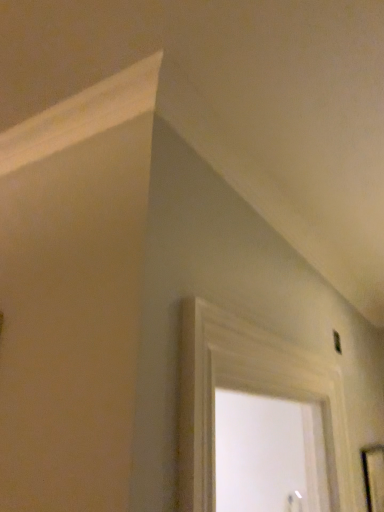
Consider the image. What is the approximate height of black glossy mirror at lower right?

black glossy mirror at lower right is 27.83 centimeters in height.

In order to face black glossy mirror at lower right, should I rotate leftwards or rightwards?

Turn right by 23.591 degrees to look at black glossy mirror at lower right.

The width and height of the screenshot is (384, 512). Describe the element at coordinates (373, 476) in the screenshot. I see `black glossy mirror at lower right` at that location.

At what (x,y) coordinates should I click in order to perform the action: click on black glossy mirror at lower right. Please return your answer as a coordinate pair (x, y). Looking at the image, I should click on (373, 476).

Find the location of a particular element. This screenshot has height=512, width=384. black glossy mirror at lower right is located at coordinates (373, 476).